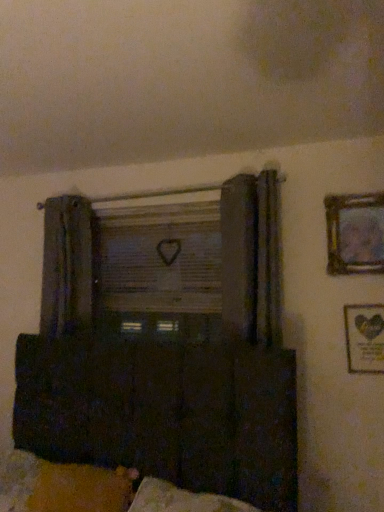
Question: Is dark wood cabinet at lower center at the left side of wooden framed picture at lower right, which is counted as the first picture frame, starting from the bottom?

Choices:
 (A) no
 (B) yes

Answer: (B)

Question: Could you tell me if dark wood cabinet at lower center is turned towards wooden framed picture at lower right, placed as the 2th picture frame when sorted from top to bottom?

Choices:
 (A) yes
 (B) no

Answer: (B)

Question: Is dark wood cabinet at lower center facing away from wooden framed picture at lower right, placed as the 2th picture frame when sorted from top to bottom?

Choices:
 (A) yes
 (B) no

Answer: (A)

Question: Considering the relative positions of dark wood cabinet at lower center and wooden framed picture at lower right, which is counted as the first picture frame, starting from the bottom, in the image provided, is dark wood cabinet at lower center to the right of wooden framed picture at lower right, which is counted as the first picture frame, starting from the bottom, from the viewer's perspective?

Choices:
 (A) yes
 (B) no

Answer: (B)

Question: Does dark wood cabinet at lower center have a lesser width compared to wooden framed picture at lower right, which is counted as the first picture frame, starting from the bottom?

Choices:
 (A) yes
 (B) no

Answer: (B)

Question: From the image's perspective, is velvety yellow pillow at lower left above or below wooden framed picture at lower right, placed as the 2th picture frame when sorted from top to bottom?

Choices:
 (A) above
 (B) below

Answer: (B)

Question: Looking at the image, does velvety yellow pillow at lower left seem bigger or smaller compared to wooden framed picture at lower right, which is counted as the first picture frame, starting from the bottom?

Choices:
 (A) small
 (B) big

Answer: (B)

Question: From a real-world perspective, relative to wooden framed picture at lower right, which is counted as the first picture frame, starting from the bottom, is velvety yellow pillow at lower left vertically above or below?

Choices:
 (A) below
 (B) above

Answer: (A)

Question: Is velvety yellow pillow at lower left spatially inside wooden framed picture at lower right, placed as the 2th picture frame when sorted from top to bottom, or outside of it?

Choices:
 (A) inside
 (B) outside

Answer: (B)

Question: From a real-world perspective, is dark wood cabinet at lower center above or below wooden framed picture at lower right, which is counted as the first picture frame, starting from the bottom?

Choices:
 (A) above
 (B) below

Answer: (B)

Question: Considering the positions of dark wood cabinet at lower center and wooden framed picture at lower right, placed as the 2th picture frame when sorted from top to bottom, in the image, is dark wood cabinet at lower center taller or shorter than wooden framed picture at lower right, placed as the 2th picture frame when sorted from top to bottom,?

Choices:
 (A) tall
 (B) short

Answer: (A)

Question: Does point (59, 455) appear closer or farther from the camera than point (375, 306)?

Choices:
 (A) farther
 (B) closer

Answer: (A)

Question: From the image's perspective, is dark wood cabinet at lower center positioned above or below wooden framed picture at lower right, which is counted as the first picture frame, starting from the bottom?

Choices:
 (A) above
 (B) below

Answer: (B)

Question: Considering the positions of velvety yellow pillow at lower left and wooden window screen at center in the image, is velvety yellow pillow at lower left bigger or smaller than wooden window screen at center?

Choices:
 (A) big
 (B) small

Answer: (B)

Question: From the image's perspective, is velvety yellow pillow at lower left located above or below wooden window screen at center?

Choices:
 (A) above
 (B) below

Answer: (B)